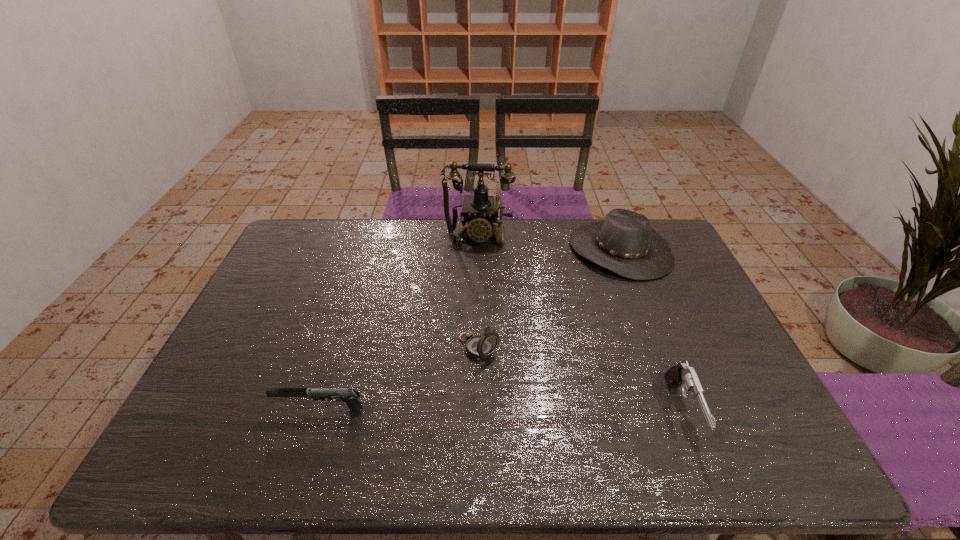
Locate an element on the screen. The height and width of the screenshot is (540, 960). vacant region between the tallest object and the hat is located at coordinates (549, 244).

Find the location of a particular element. This screenshot has height=540, width=960. free space between the hat and the telephone is located at coordinates (549, 244).

The width and height of the screenshot is (960, 540). Identify the location of blank region between the third nearest object and the hat. (550, 299).

You are a GUI agent. You are given a task and a screenshot of the screen. Output one action in this format:
    pyautogui.click(x=<x>, y=<y>)
    Task: Click on the vacant area that lies between the third farthest object and the hat
    Image resolution: width=960 pixels, height=540 pixels.
    Given the screenshot: What is the action you would take?
    pyautogui.click(x=550, y=299)

Where is `vacant area between the taller gun and the left gun`? This screenshot has height=540, width=960. vacant area between the taller gun and the left gun is located at coordinates (502, 411).

Locate an element on the screen. This screenshot has width=960, height=540. free point between the right gun and the hat is located at coordinates (651, 331).

Identify the location of object that is the fourth closest one to the compass. The image size is (960, 540). (683, 375).

Identify the location of object that stands as the fourth closest to the shorter gun. (624, 243).